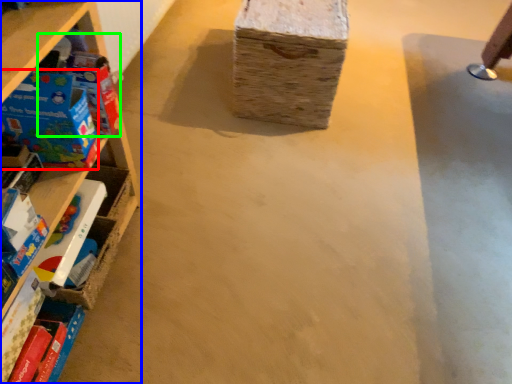
Question: Which object is the closest to the toy (highlighted by a red box)? Choose among these: shelf (highlighted by a blue box) or toy (highlighted by a green box).

Choices:
 (A) shelf
 (B) toy

Answer: (B)